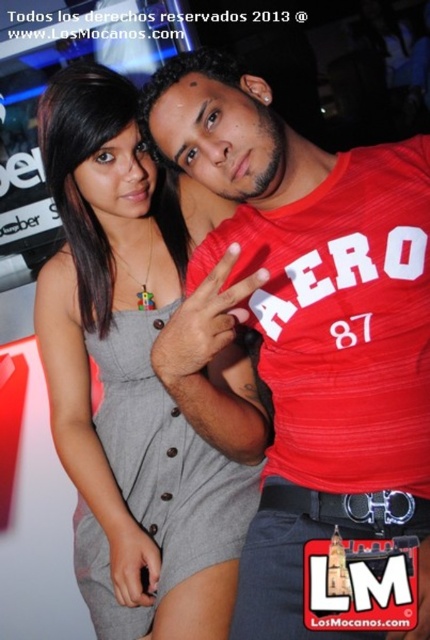
Who is more forward, (328, 536) or (147, 442)?

Positioned in front is point (328, 536).

Which is behind, point (286, 317) or point (37, 333)?

The point (37, 333) is behind.

The width and height of the screenshot is (430, 640). What are the coordinates of `red cotton t-shirt at center` in the screenshot? It's located at (315, 323).